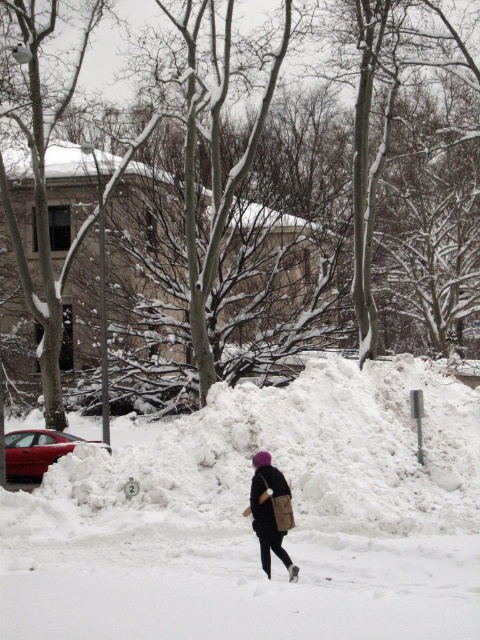
You are a delivery robot with a 1.5 meter wide package. You need to move from the building to the red car parked nearby. There is white fluffy snow at center and a dark brown leather jacket at center in your path. Can you pass through the space between them without hitting the package?

The distance between white fluffy snow at center and dark brown leather jacket at center is 2.23 meters. Since your package is 1.5 meters wide, there is enough space to pass through safely.

You are a delivery person trying to walk through the white fluffy snow at center while wearing the dark brown leather jacket at center. Can you walk through the snow without sinking up to your knees?

The white fluffy snow at center has a greater height compared to dark brown leather jacket at center, which means the snow is deeper than the jacket. Since the snow is deeper than the jacket, you might sink up to your knees or deeper when walking through it.

You are a photographer trying to capture the scene. You notice the white fluffy snow at center and the dark brown leather jacket at center. Which object is positioned higher in the image?

The white fluffy snow at center is located above the dark brown leather jacket at center, so it is positioned higher in the image.